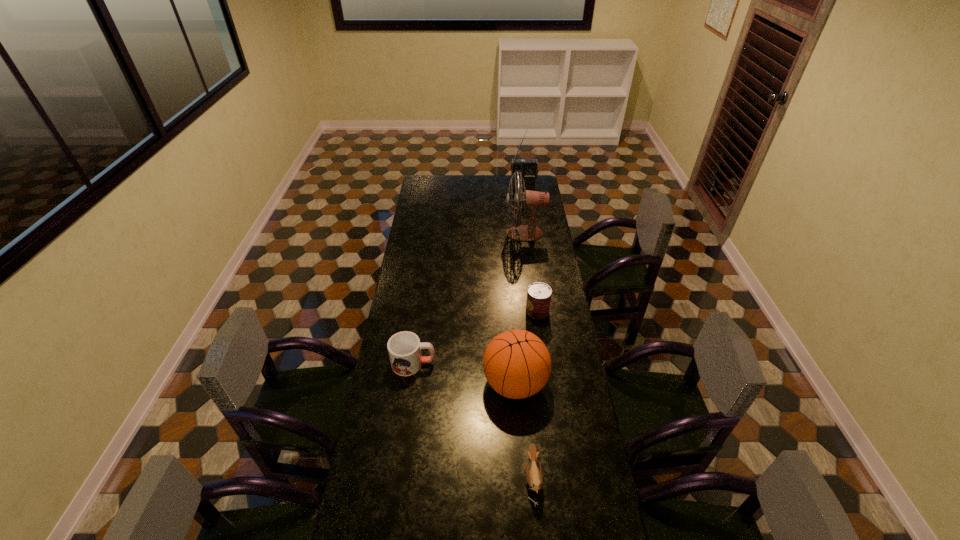
Identify the location of fan that is at the right edge. This screenshot has width=960, height=540. (532, 200).

Locate an element on the screen. Image resolution: width=960 pixels, height=540 pixels. basketball that is at the right edge is located at coordinates (517, 364).

Locate an element on the screen. The height and width of the screenshot is (540, 960). can situated at the right edge is located at coordinates (539, 294).

You are a GUI agent. You are given a task and a screenshot of the screen. Output one action in this format:
    pyautogui.click(x=<x>, y=<y>)
    Task: Click on the object that is at the far right corner
    The height and width of the screenshot is (540, 960).
    Given the screenshot: What is the action you would take?
    pyautogui.click(x=528, y=168)

Where is `vacant space at the far edge of the desktop`? vacant space at the far edge of the desktop is located at coordinates (449, 176).

You are a GUI agent. You are given a task and a screenshot of the screen. Output one action in this format:
    pyautogui.click(x=<x>, y=<y>)
    Task: Click on the vacant space at the left edge of the desktop
    
    Given the screenshot: What is the action you would take?
    pyautogui.click(x=400, y=310)

You are a GUI agent. You are given a task and a screenshot of the screen. Output one action in this format:
    pyautogui.click(x=<x>, y=<y>)
    Task: Click on the free space at the right edge of the desktop
    
    Given the screenshot: What is the action you would take?
    pyautogui.click(x=580, y=539)

Where is `vacant space at the far left corner of the desktop`? Image resolution: width=960 pixels, height=540 pixels. vacant space at the far left corner of the desktop is located at coordinates (429, 176).

Locate an element on the screen. The height and width of the screenshot is (540, 960). vacant space in between the radio receiver and the third farthest object is located at coordinates (530, 249).

This screenshot has width=960, height=540. I want to click on free point between the leftmost object and the bird, so click(473, 421).